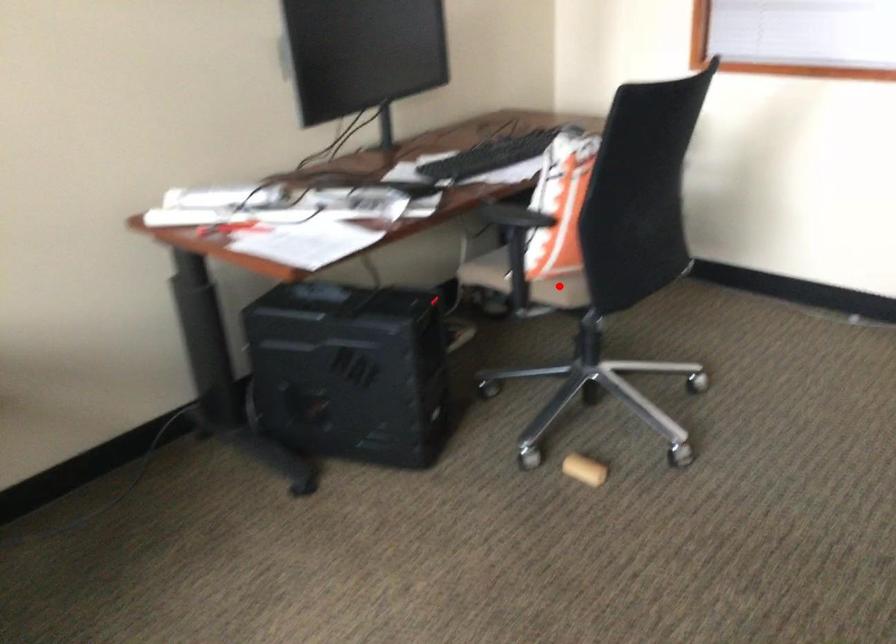
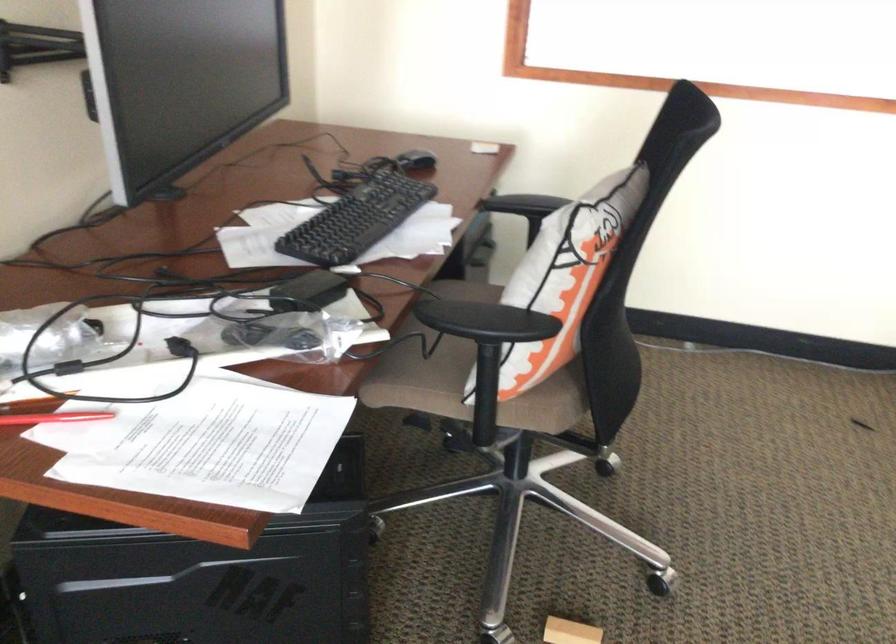
Question: A red point is marked in image1. In image2, is the corresponding 3D point closer to the camera or farther? Reply with the corresponding letter.

Choices:
 (A) The corresponding 3D point is closer.
 (B) The corresponding 3D point is farther.

Answer: (A)